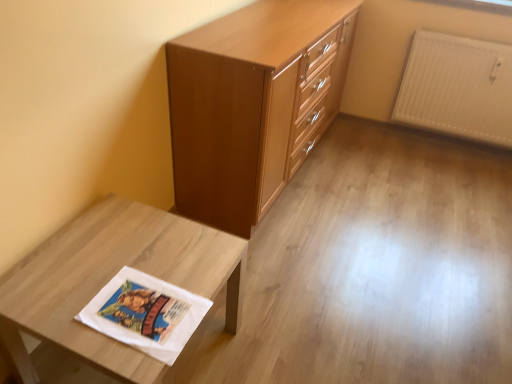
Find the location of `vacant area situated to the left side of white textured radiator at upper right`. vacant area situated to the left side of white textured radiator at upper right is located at coordinates (386, 149).